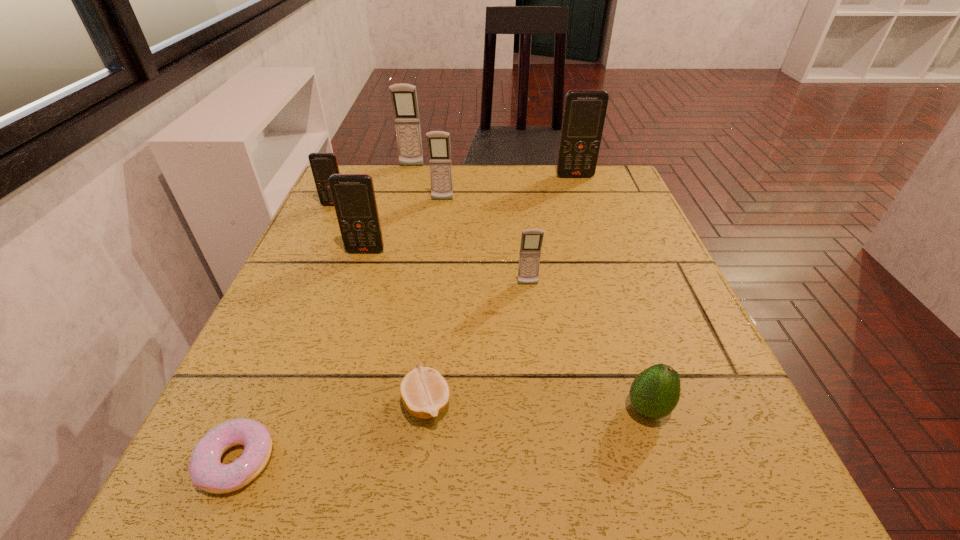
At what (x,y) coordinates should I click in order to perform the action: click on the farthest gray cellular telephone. Please return your answer as a coordinate pair (x, y). This screenshot has width=960, height=540. Looking at the image, I should click on (403, 96).

Image resolution: width=960 pixels, height=540 pixels. What are the coordinates of `the leftmost gray cellular telephone` in the screenshot? It's located at (403, 96).

This screenshot has width=960, height=540. In order to click on the rightmost orange cellular telephone in this screenshot , I will do `click(584, 113)`.

Find the location of a particular element. the second farthest cellular telephone is located at coordinates (584, 113).

I want to click on the second gray cellular telephone from right to left, so click(x=438, y=142).

The height and width of the screenshot is (540, 960). What are the coordinates of `the fourth cellular telephone from left to right` in the screenshot? It's located at (438, 142).

Find the location of a particular element. The image size is (960, 540). the second nearest cellular telephone is located at coordinates (353, 195).

Where is `the nearest orange cellular telephone`? The height and width of the screenshot is (540, 960). the nearest orange cellular telephone is located at coordinates (353, 195).

Find the location of a particular element. Image resolution: width=960 pixels, height=540 pixels. the sixth nearest object is located at coordinates (323, 165).

The width and height of the screenshot is (960, 540). I want to click on the smallest orange cellular telephone, so click(323, 165).